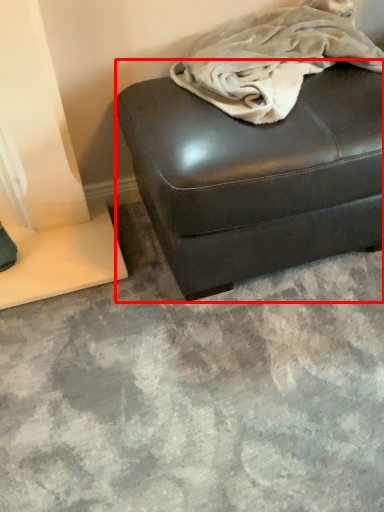
Question: Considering the relative positions of furniture (annotated by the red box) and blanket in the image provided, where is furniture (annotated by the red box) located with respect to the staircase?

Choices:
 (A) left
 (B) right

Answer: (A)